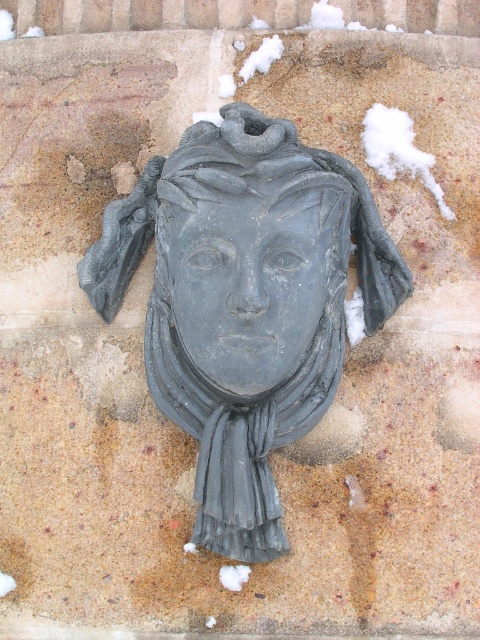
Question: Can you confirm if matte gray stone head at center is positioned to the right of matte gray stone face at center?

Choices:
 (A) yes
 (B) no

Answer: (B)

Question: Which of the following is the closest to the observer?

Choices:
 (A) matte gray scarf at center
 (B) matte gray stone head at center
 (C) matte gray stone face at center

Answer: (C)

Question: Does matte gray stone face at center appear on the left side of matte gray scarf at center?

Choices:
 (A) yes
 (B) no

Answer: (B)

Question: Where is matte gray stone head at center located in relation to matte gray scarf at center in the image?

Choices:
 (A) below
 (B) above

Answer: (B)

Question: Which point is farther from the camera taking this photo?

Choices:
 (A) (344, 326)
 (B) (228, 461)
 (C) (286, 308)

Answer: (A)

Question: Which point is closer to the camera?

Choices:
 (A) (320, 349)
 (B) (213, 202)
 (C) (133, 253)

Answer: (B)